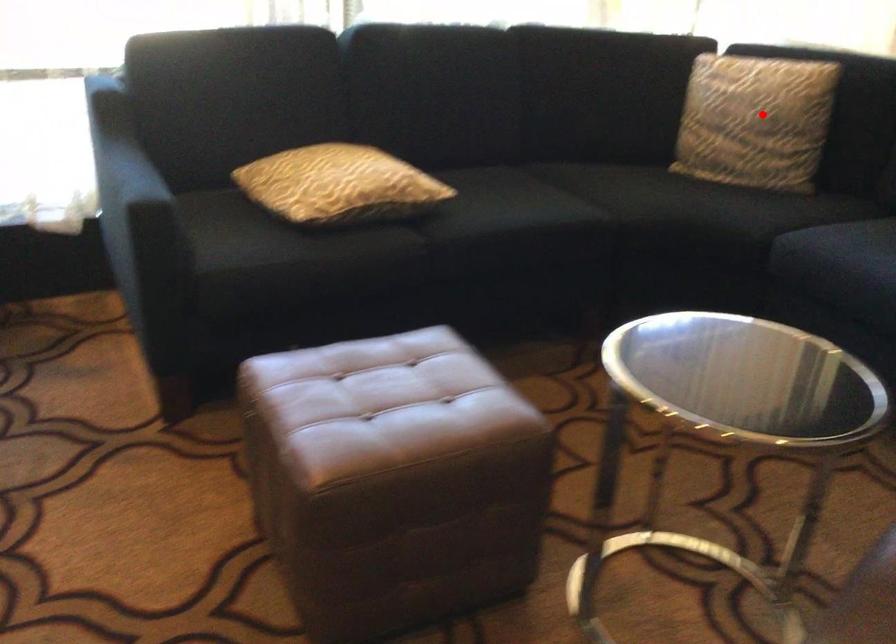
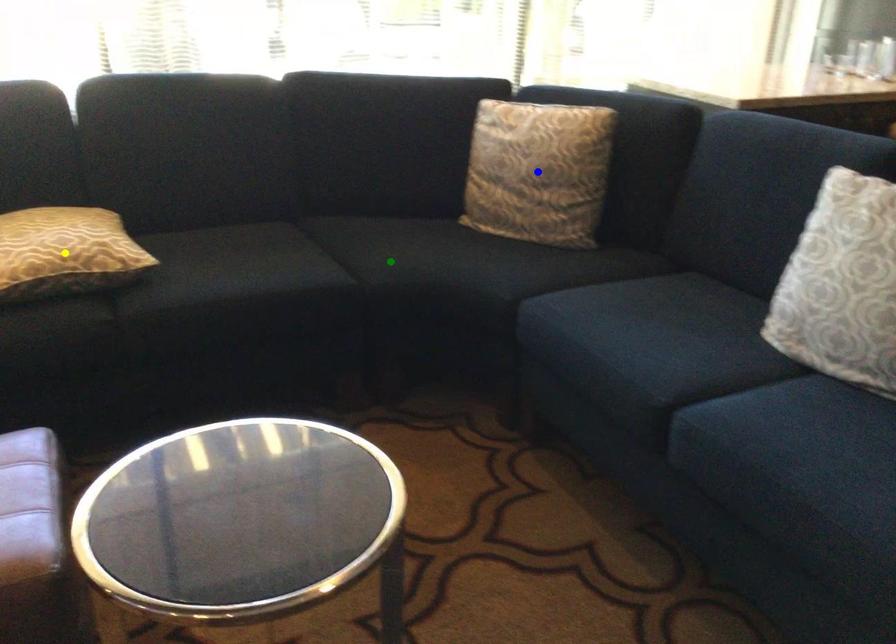
Question: I am providing you with two images of the same scene from different viewpoints. A red point is marked on the first image. You are given multiple points on the second image. Can you choose the point in image 2 that corresponds to the point in image 1?

Choices:
 (A) blue point
 (B) yellow point
 (C) green point

Answer: (A)